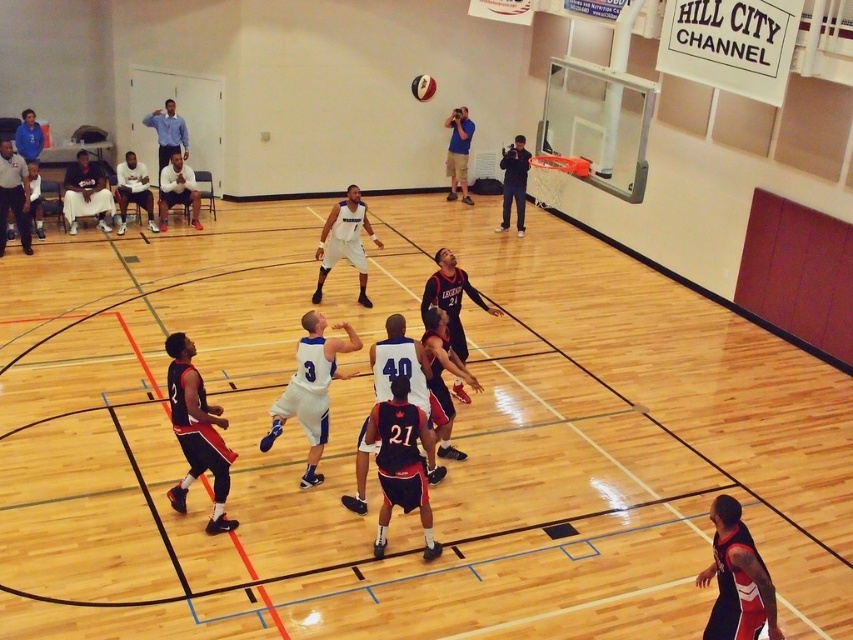
You are a spectator sitting in the stands watching the basketball game. You want to grab the matte black basketball at upper left that just rolled away from the play. The court has a safety rule that spectators must stay at least 10 meters away from the ball to avoid interfering with the game. Are you allowed to reach out and pick up the ball from your current position?

The matte black basketball at upper left is 11.28 meters away from camera. Since the safety rule requires spectators to stay at least 10 meters away, you are allowed to reach out and pick up the matte black basketball at upper left because you are beyond the required distance.

You are a basketball player standing at the baseline. You want to get to the wooden floor at center as quickly as possible. Which direction should you move in?

The wooden floor at center is located at point 0.727 on the x axis and 0.438 on the y axis. Since you are at the baseline, you should move towards the center of the court to reach the wooden floor at center.